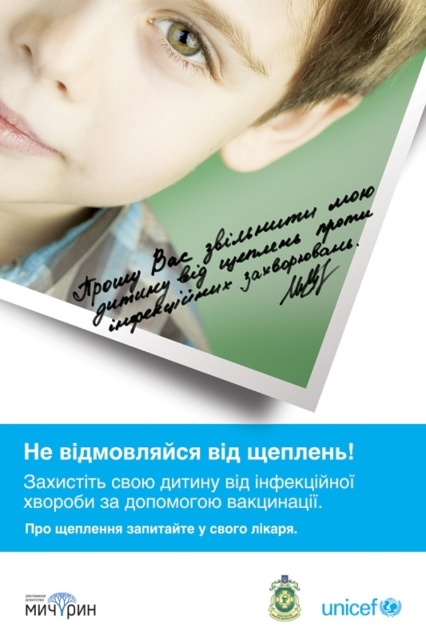
You are a graphic designer reviewing a poster. You notice two elements at the top of the poster. The first is the matte skin face at upper center and the second is the green matte eye at upper center. Which of these elements is located more to the left side?

The matte skin face at upper center is positioned on the left side of green matte eye at upper center, so the matte skin face at upper center is more to the left.

You are a graphic designer reviewing a poster for a public health campaign. You notice two faces labeled as smooth skin face at upper center and matte skin face at upper center. Which face is located to the right of the other?

The smooth skin face at upper center is positioned on the right side of matte skin face at upper center.